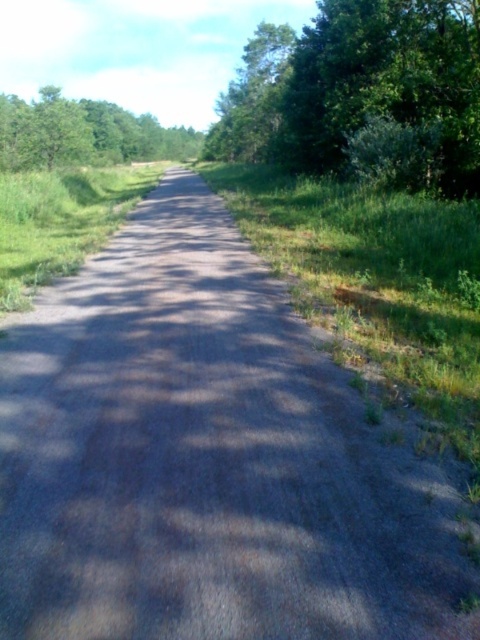
Can you confirm if green leafy tree at upper right is wider than green leafy tree at upper left?

Incorrect, green leafy tree at upper right's width does not surpass green leafy tree at upper left's.

Can you confirm if green leafy tree at upper right is bigger than green leafy tree at upper left?

Yes, green leafy tree at upper right is bigger than green leafy tree at upper left.

Is point (458, 96) positioned before point (60, 109)?

Yes, it is in front of point (60, 109).

Locate an element on the screen. The width and height of the screenshot is (480, 640). green leafy tree at upper right is located at coordinates (361, 96).